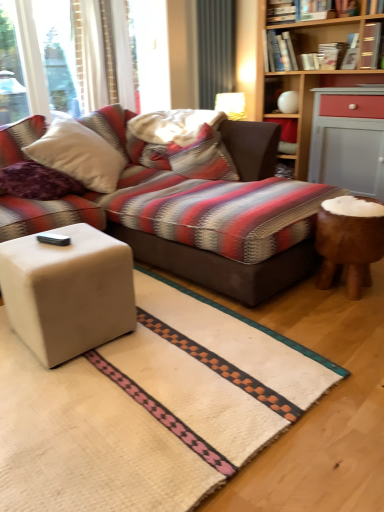
The width and height of the screenshot is (384, 512). Identify the location of blank space situated above beige matte cube at lower left (from a real-world perspective). (57, 242).